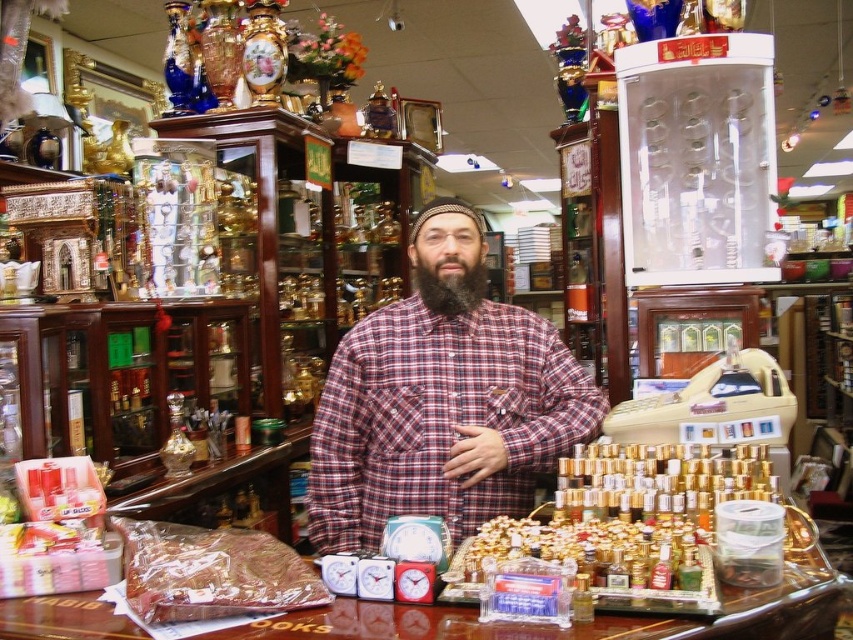
Between point (482, 381) and point (260, 561), which one is positioned in front?

Point (260, 561) is more forward.

Which is below, plaid cotton shirt at center or translucent plastic bag at lower left?

Positioned lower is translucent plastic bag at lower left.

Is point (456, 534) closer to camera compared to point (310, 576)?

No, it is behind (310, 576).

This screenshot has width=853, height=640. Find the location of `plaid cotton shirt at center`. plaid cotton shirt at center is located at coordinates (440, 419).

At what (x,y) coordinates should I click in order to perform the action: click on translucent plastic bag at lower left. Please return your answer as a coordinate pair (x, y). Image resolution: width=853 pixels, height=640 pixels. Looking at the image, I should click on (212, 572).

Can you confirm if translucent plastic bag at lower left is bigger than metallic gold bottles at center?

Correct, translucent plastic bag at lower left is larger in size than metallic gold bottles at center.

The height and width of the screenshot is (640, 853). What do you see at coordinates (212, 572) in the screenshot?
I see `translucent plastic bag at lower left` at bounding box center [212, 572].

Locate an element on the screen. The width and height of the screenshot is (853, 640). translucent plastic bag at lower left is located at coordinates (212, 572).

Is metallic gold bottles at center shorter than black matte beard at center?

Yes, metallic gold bottles at center is shorter than black matte beard at center.

Which is above, metallic gold bottles at center or black matte beard at center?

black matte beard at center is above.

Is point (613, 588) less distant than point (415, 273)?

Yes, it is in front of point (415, 273).

Image resolution: width=853 pixels, height=640 pixels. I want to click on metallic gold bottles at center, so click(x=589, y=550).